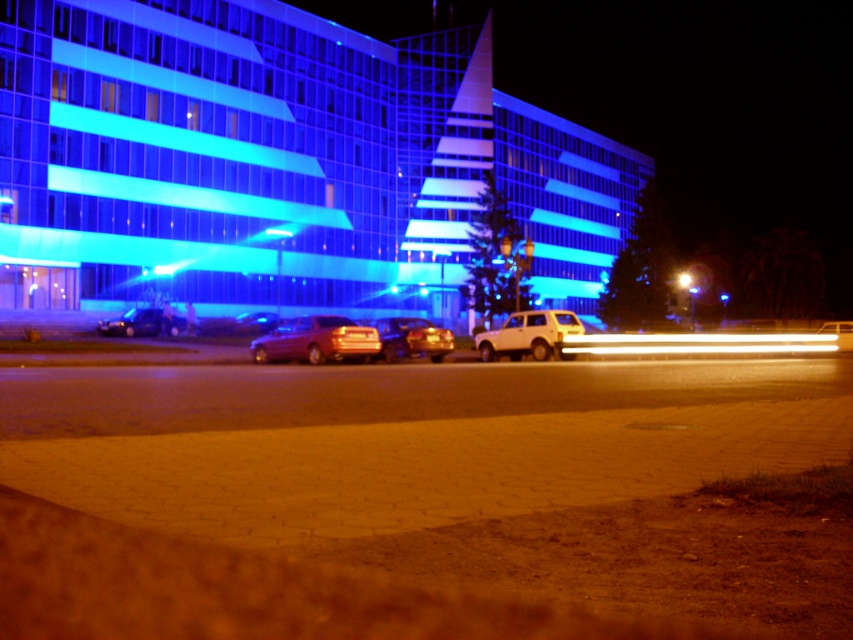
You are a delivery person who needs to park your 1.8 meters tall delivery box in the parking area. You see the metallic red sedan at center and the shiny black sedan at center. Can you place the delivery box between them?

The metallic red sedan at center is taller than the shiny black sedan at center. Since the delivery box is 1.8 meters tall, it might not fit between them if the space between the sedans is constrained by their heights. However, the description only mentions height comparison, not the distance between them. Without information on the horizontal space, it is uncertain if the box can fit vertically or horizontally.

You are standing at the point marked as point (x=316, y=340) in the image. What color is the vehicle located exactly at that point?

The metallic red sedan at center is located at point (x=316, y=340).

You are a delivery driver who needs to park your truck, which is 17 meters long, between the white matte suv at center and the metallic silver car at center. Is there enough space for your truck to fit between them?

The distance between the white matte suv at center and the metallic silver car at center is 16.81 meters. Since your truck is 17 meters long, there is not enough space for it to fit between them.